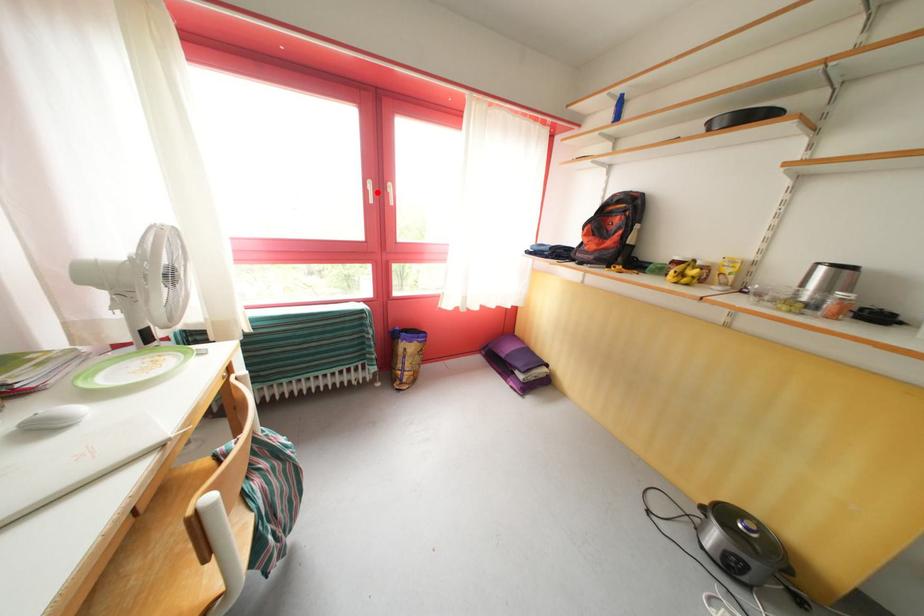
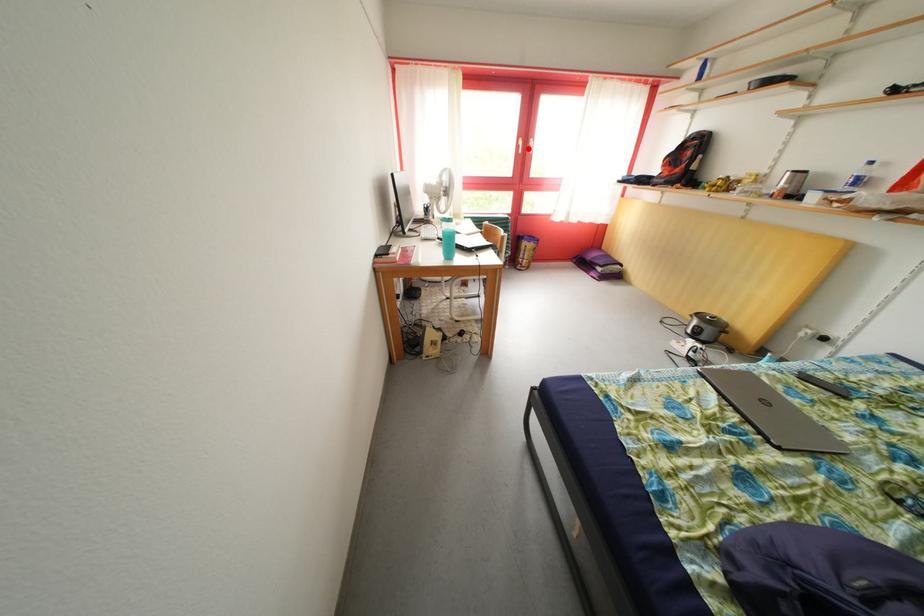
I am providing you with two images of the same scene from different viewpoints. A red point is marked on the first image and another point is marked on the second image. Is the red point in image1 aligned with the point shown in image2?

Yes